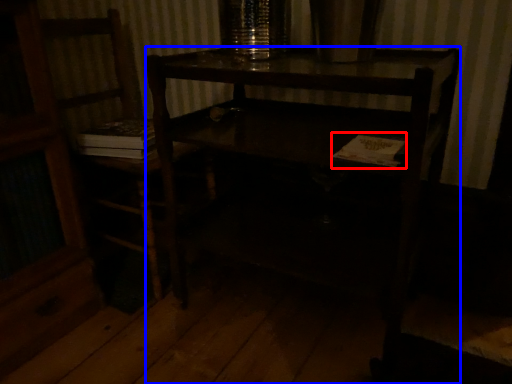
Question: Which point is further to the camera, book (highlighted by a red box) or desk (highlighted by a blue box)?

Choices:
 (A) book
 (B) desk

Answer: (A)